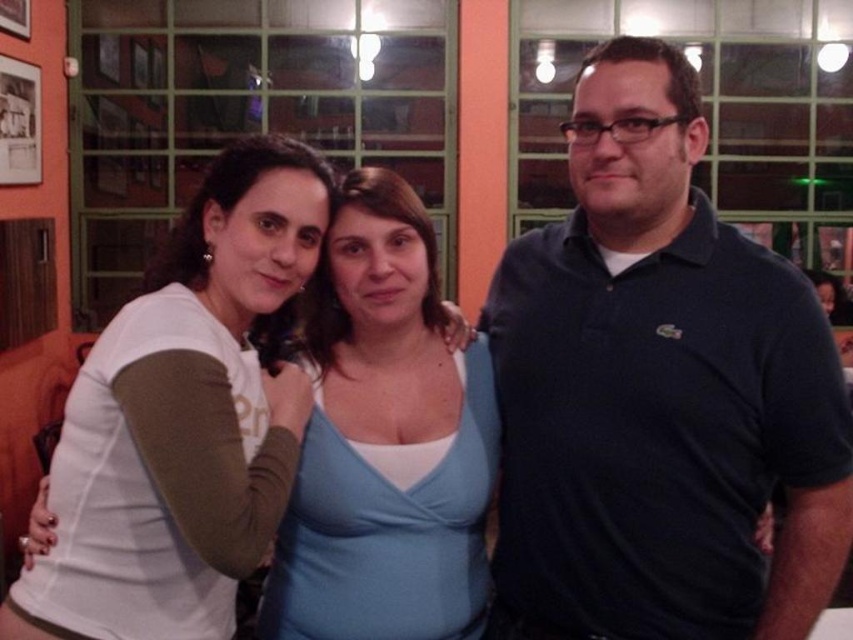
How much distance is there between light blue fabric top at center and white matte shirt at upper left?

A distance of 7.84 inches exists between light blue fabric top at center and white matte shirt at upper left.

Who is more forward, (456, 424) or (155, 490)?

Point (155, 490) is more forward.

Which is behind, point (425, 451) or point (213, 381)?

Point (425, 451)

I want to click on light blue fabric top at center, so click(x=386, y=442).

Describe the element at coordinates (659, 392) in the screenshot. I see `dark blue polo shirt at center` at that location.

Which is in front, point (840, 499) or point (306, 579)?

Point (840, 499) is in front.

You are a GUI agent. You are given a task and a screenshot of the screen. Output one action in this format:
    pyautogui.click(x=<x>, y=<y>)
    Task: Click on the dark blue polo shirt at center
    The width and height of the screenshot is (853, 640).
    Given the screenshot: What is the action you would take?
    pyautogui.click(x=659, y=392)

What do you see at coordinates (659, 392) in the screenshot? I see `dark blue polo shirt at center` at bounding box center [659, 392].

Does dark blue polo shirt at center have a lesser height compared to white matte shirt at upper left?

In fact, dark blue polo shirt at center may be taller than white matte shirt at upper left.

Is point (757, 257) farther from viewer compared to point (209, 458)?

Yes, point (757, 257) is farther from viewer.

Locate an element on the screen. dark blue polo shirt at center is located at coordinates (659, 392).